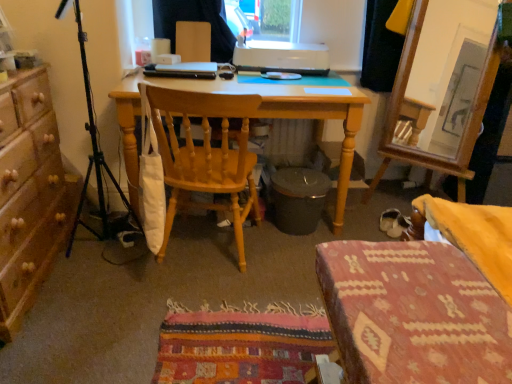
Image resolution: width=512 pixels, height=384 pixels. Identify the location of space that is in front of black matte tripod at left. (93, 297).